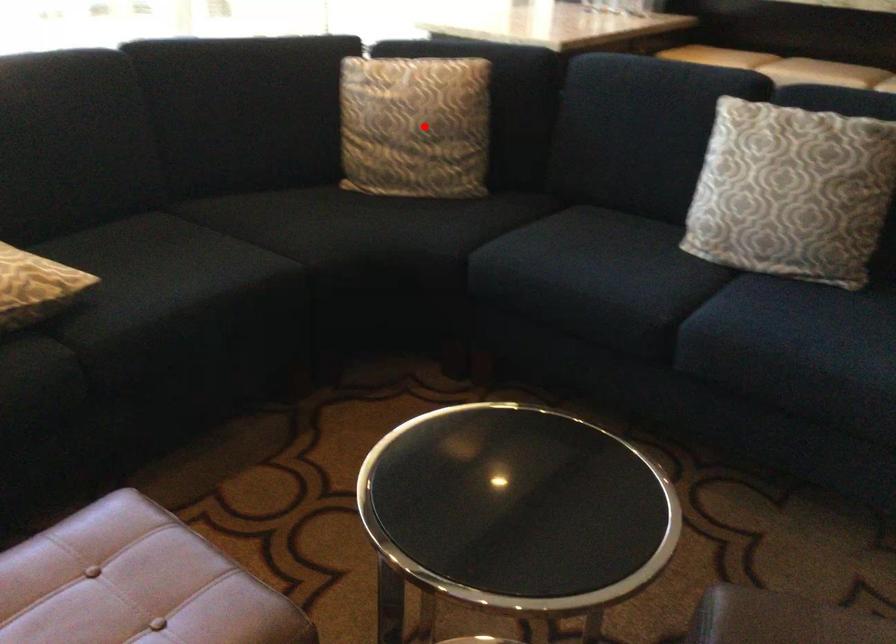
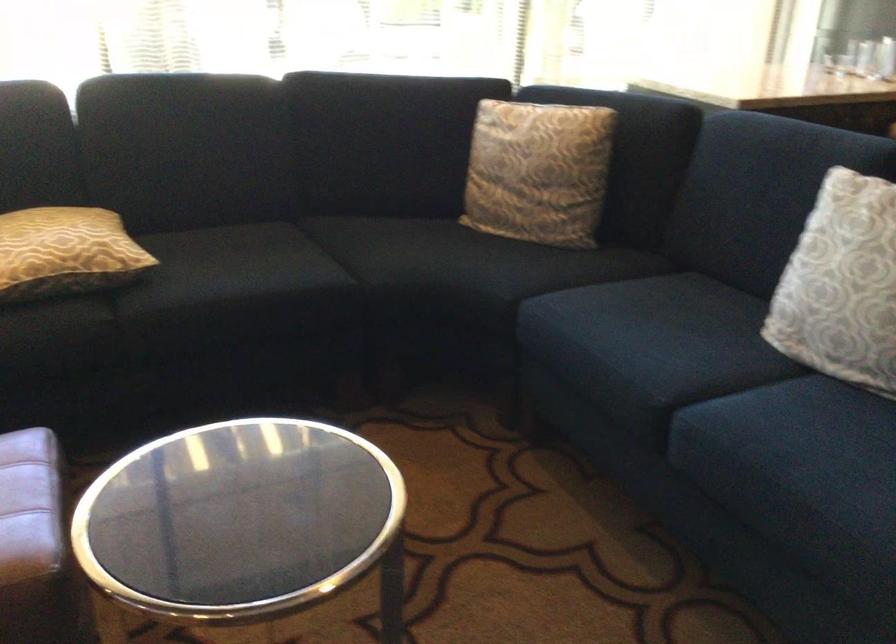
Where in the second image is the point corresponding to the highlighted location from the first image?

(538, 172)